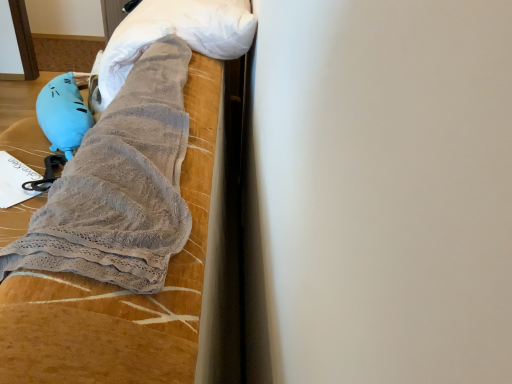
Question: Considering their positions, is velvet-like fabric bedspread at upper left located in front of or behind matte blue plush at left?

Choices:
 (A) behind
 (B) front

Answer: (B)

Question: In terms of width, does velvet-like fabric bedspread at upper left look wider or thinner when compared to matte blue plush at left?

Choices:
 (A) thin
 (B) wide

Answer: (B)

Question: Which is nearer to the gray fuzzy towel at upper center?

Choices:
 (A) velvet-like fabric bedspread at upper left
 (B) matte blue plush at left

Answer: (A)

Question: Which is nearer to the velvet-like fabric bedspread at upper left?

Choices:
 (A) gray fuzzy towel at upper center
 (B) matte blue plush at left

Answer: (A)